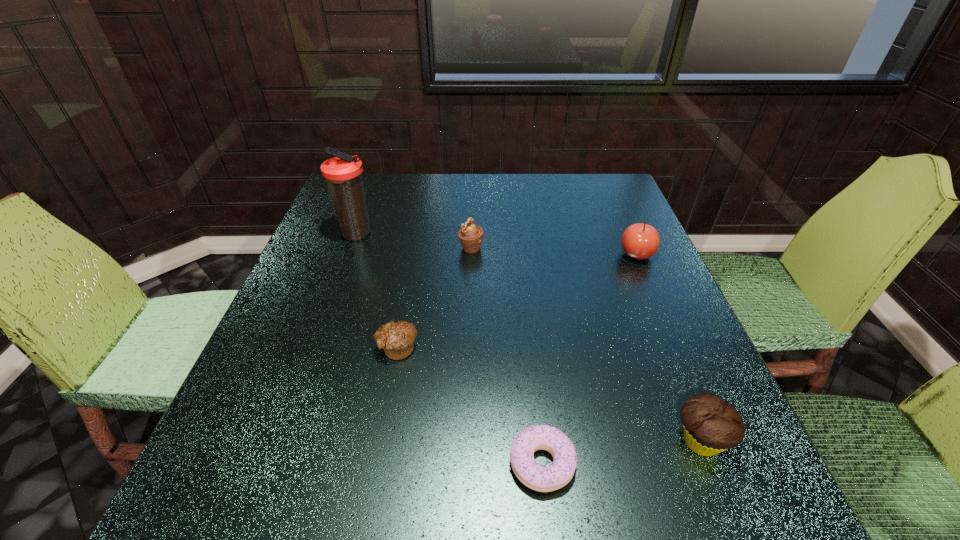
Identify the location of vacant space at the far edge of the desktop. (399, 203).

Find the location of a particular element. vacant area at the near edge of the desktop is located at coordinates (525, 529).

Where is `vacant space at the left edge of the desktop`? vacant space at the left edge of the desktop is located at coordinates (256, 395).

This screenshot has height=540, width=960. I want to click on vacant space at the right edge of the desktop, so click(678, 339).

What are the coordinates of `blank space at the near right corner of the desktop` in the screenshot? It's located at (737, 500).

The height and width of the screenshot is (540, 960). In order to click on free space between the fourth object from right to left and the shortest object in this screenshot , I will do `click(506, 356)`.

This screenshot has width=960, height=540. I want to click on vacant space that's between the shortest muffin and the fourth object from right to left, so click(434, 298).

This screenshot has height=540, width=960. What are the coordinates of `vacant area between the second shortest object and the leftmost object` in the screenshot? It's located at (377, 291).

What are the coordinates of `free point between the farthest muffin and the leftmost muffin` in the screenshot? It's located at (434, 298).

Locate an element on the screen. This screenshot has width=960, height=540. empty location between the doughnut and the shortest muffin is located at coordinates (469, 406).